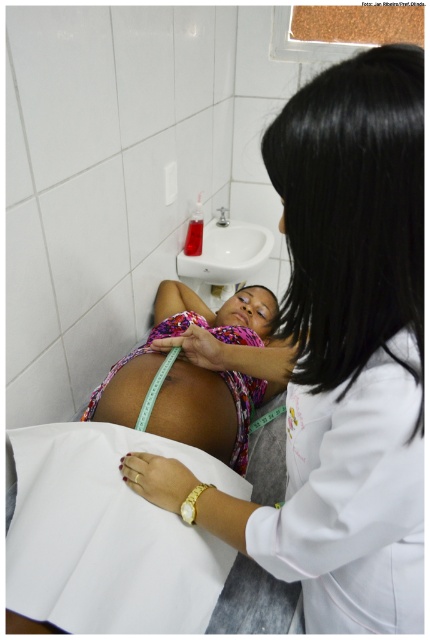
Question: Which of these objects is positioned closest to the matte green tape at center?

Choices:
 (A) pink fabric at center
 (B) multicolored fabric baby at center

Answer: (B)

Question: Which object is positioned farthest from the multicolored fabric baby at center?

Choices:
 (A) pink fabric at center
 (B) white glossy sink at upper center

Answer: (B)

Question: Can you confirm if multicolored fabric baby at center is smaller than white glossy sink at upper center?

Choices:
 (A) yes
 (B) no

Answer: (B)

Question: Considering the relative positions of matte green tape at center and white glossy sink at upper center in the image provided, where is matte green tape at center located with respect to white glossy sink at upper center?

Choices:
 (A) below
 (B) above

Answer: (A)

Question: Which object is farther from the camera taking this photo?

Choices:
 (A) white glossy sink at upper center
 (B) pink fabric at center
 (C) matte green tape at center
 (D) multicolored fabric baby at center

Answer: (A)

Question: From the image, what is the correct spatial relationship of multicolored fabric baby at center in relation to white glossy sink at upper center?

Choices:
 (A) above
 (B) below

Answer: (B)